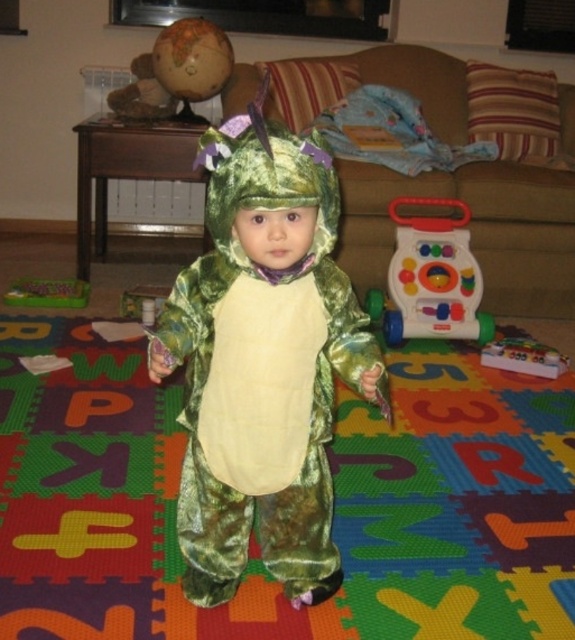
You are a photographer standing at a certain distance from the velvet green costume at center. You want to take a closeup shot of the costume without moving the camera. What adjustment should you make to your camera?

You should zoom in on the velvet green costume at center since it is 35.91 inches away from the camera and you cannot move closer.

You are a parent trying to organize the play area. You see the multicolored plastic walker at center and the green plastic toy at lower left. Which object is positioned higher up in the image?

The multicolored plastic walker at center is positioned higher up in the image than the green plastic toy at lower left.

You are a parent trying to place two stickers on the play mat. The first sticker must be placed at point [455,218] and the second at point [82,294]. Which sticker will be closer to your child in the green dinosaur costume?

The sticker placed at point [455,218] will be closer to the child in the green dinosaur costume because it is closer to the viewer than point [82,294].